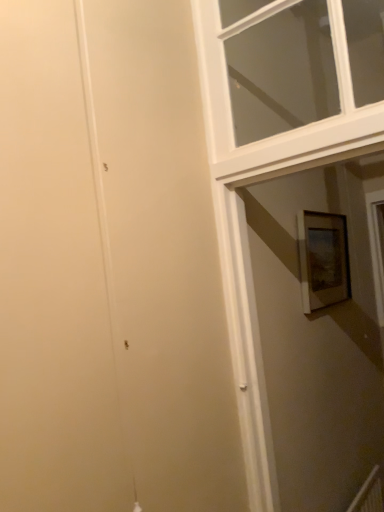
Measure the distance between wooden framed picture at right and camera.

wooden framed picture at right and camera are 1.73 meters apart.

Describe the element at coordinates (323, 259) in the screenshot. The height and width of the screenshot is (512, 384). I see `wooden framed picture at right` at that location.

Find the location of a particular element. wooden framed picture at right is located at coordinates (323, 259).

Identify the location of white wooden window at upper right. The height and width of the screenshot is (512, 384). (228, 84).

Measure the distance between white wooden window at upper right and camera.

The distance of white wooden window at upper right from camera is 37.98 inches.

What do you see at coordinates (228, 84) in the screenshot?
I see `white wooden window at upper right` at bounding box center [228, 84].

You are a GUI agent. You are given a task and a screenshot of the screen. Output one action in this format:
    pyautogui.click(x=<x>, y=<y>)
    Task: Click on the wooden framed picture at right
    This screenshot has height=512, width=384.
    Given the screenshot: What is the action you would take?
    pyautogui.click(x=323, y=259)

Between white wooden window at upper right and wooden framed picture at right, which one appears on the right side from the viewer's perspective?

wooden framed picture at right.

Considering the positions of objects white wooden window at upper right and wooden framed picture at right in the image provided, who is behind, white wooden window at upper right or wooden framed picture at right?

wooden framed picture at right is more distant.

Which point is more forward, (280,138) or (308,278)?

The point (280,138) is closer.

From the picture: From the image's perspective, does white wooden window at upper right appear lower than wooden framed picture at right?

Actually, white wooden window at upper right appears above wooden framed picture at right in the image.

From a real-world perspective, is white wooden window at upper right below wooden framed picture at right?

No, from a real-world perspective, white wooden window at upper right is not under wooden framed picture at right.

Does white wooden window at upper right have a lesser width compared to wooden framed picture at right?

No, white wooden window at upper right is not thinner than wooden framed picture at right.

Considering the sizes of objects white wooden window at upper right and wooden framed picture at right in the image provided, who is taller, white wooden window at upper right or wooden framed picture at right?

white wooden window at upper right.

Does white wooden window at upper right have a larger size compared to wooden framed picture at right?

Correct, white wooden window at upper right is larger in size than wooden framed picture at right.

Is wooden framed picture at right a part of white wooden window at upper right?

No.

Are white wooden window at upper right and wooden framed picture at right far apart?

white wooden window at upper right is near wooden framed picture at right, not far away.

Is white wooden window at upper right oriented towards wooden framed picture at right?

No, white wooden window at upper right is not turned towards wooden framed picture at right.

How many degrees apart are the facing directions of white wooden window at upper right and wooden framed picture at right?

The angular difference between white wooden window at upper right and wooden framed picture at right is 92.1 degrees.

The image size is (384, 512). I want to click on picture frame below the white wooden window at upper right (from a real-world perspective), so click(x=323, y=259).

Is wooden framed picture at right at the left side of white wooden window at upper right?

In fact, wooden framed picture at right is to the right of white wooden window at upper right.

Which object is further away from the camera, wooden framed picture at right or white wooden window at upper right?

wooden framed picture at right is further from the camera.

Between point (342, 246) and point (217, 48), which one is positioned in front?

The point (217, 48) is closer to the camera.

From the image's perspective, is wooden framed picture at right located above or below white wooden window at upper right?

wooden framed picture at right is situated lower than white wooden window at upper right in the image.

From a real-world perspective, is wooden framed picture at right under white wooden window at upper right?

Correct, in the physical world, wooden framed picture at right is lower than white wooden window at upper right.

Does wooden framed picture at right have a lesser width compared to white wooden window at upper right?

Correct, the width of wooden framed picture at right is less than that of white wooden window at upper right.

Between wooden framed picture at right and white wooden window at upper right, which one has more height?

Standing taller between the two is white wooden window at upper right.

Does wooden framed picture at right have a smaller size compared to white wooden window at upper right?

Correct, wooden framed picture at right occupies less space than white wooden window at upper right.

Can we say wooden framed picture at right lies outside white wooden window at upper right?

Yes.

Looking at this image, are wooden framed picture at right and white wooden window at upper right far apart?

wooden framed picture at right is near white wooden window at upper right, not far away.

Is wooden framed picture at right oriented away from white wooden window at upper right?

That's not correct — wooden framed picture at right is not looking away from white wooden window at upper right.

I want to click on window on the left of wooden framed picture at right, so click(x=228, y=84).

Locate an element on the screen. This screenshot has width=384, height=512. window that appears above the wooden framed picture at right (from the image's perspective) is located at coordinates (228, 84).

This screenshot has width=384, height=512. I want to click on picture frame that appears behind the white wooden window at upper right, so click(323, 259).